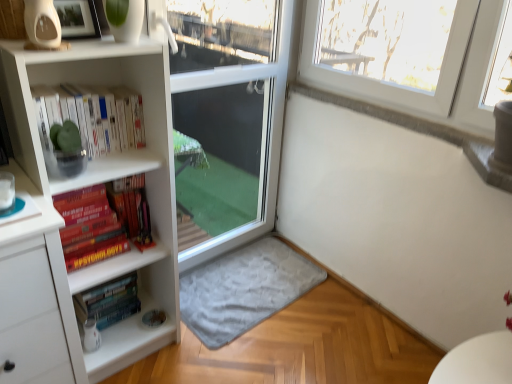
Question: From a real-world perspective, does hardcover books at lower left, which appears as the 2th book when viewed from the top, sit lower than hardcover psychology book at left, which is the 1th book in top-to-bottom order?

Choices:
 (A) yes
 (B) no

Answer: (A)

Question: Is hardcover books at lower left, which appears as the 2th book when viewed from the top, wider than hardcover psychology book at left, which is the 1th book in top-to-bottom order?

Choices:
 (A) no
 (B) yes

Answer: (A)

Question: From the image's perspective, would you say hardcover books at lower left, which appears as the 2th book when viewed from the top, is positioned over hardcover psychology book at left, which is the 2th book from bottom to top?

Choices:
 (A) yes
 (B) no

Answer: (B)

Question: Can you confirm if hardcover books at lower left, which appears as the 2th book when viewed from the top, is taller than hardcover psychology book at left, which is the 2th book from bottom to top?

Choices:
 (A) no
 (B) yes

Answer: (A)

Question: Is hardcover books at lower left, the 1th book when ordered from bottom to top, aimed at hardcover psychology book at left, which is the 2th book from bottom to top?

Choices:
 (A) yes
 (B) no

Answer: (B)

Question: Is hardcover books at lower left, which appears as the 2th book when viewed from the top, outside of hardcover psychology book at left, which is the 2th book from bottom to top?

Choices:
 (A) no
 (B) yes

Answer: (B)

Question: Is white glossy bookshelf at upper left aimed at hardcover psychology book at left, which is the 1th book in top-to-bottom order?

Choices:
 (A) yes
 (B) no

Answer: (B)

Question: Is white glossy bookshelf at upper left turned away from hardcover psychology book at left, which is the 2th book from bottom to top?

Choices:
 (A) yes
 (B) no

Answer: (B)

Question: Can you confirm if white glossy bookshelf at upper left is shorter than hardcover psychology book at left, which is the 1th book in top-to-bottom order?

Choices:
 (A) yes
 (B) no

Answer: (A)

Question: Does white glossy bookshelf at upper left contain hardcover psychology book at left, which is the 2th book from bottom to top?

Choices:
 (A) yes
 (B) no

Answer: (B)

Question: Considering the relative positions of white glossy bookshelf at upper left and hardcover psychology book at left, which is the 2th book from bottom to top, in the image provided, is white glossy bookshelf at upper left to the right of hardcover psychology book at left, which is the 2th book from bottom to top, from the viewer's perspective?

Choices:
 (A) yes
 (B) no

Answer: (A)

Question: Is white glossy bookshelf at upper left not close to hardcover psychology book at left, which is the 2th book from bottom to top?

Choices:
 (A) yes
 (B) no

Answer: (B)

Question: Are gray soft rug at lower center and white glossy bookshelf at upper left making contact?

Choices:
 (A) yes
 (B) no

Answer: (B)